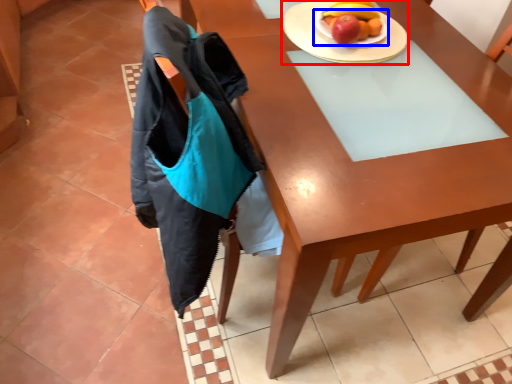
Question: Among these objects, which one is farthest to the camera, plate (highlighted by a red box) or plate (highlighted by a blue box)?

Choices:
 (A) plate
 (B) plate

Answer: (B)